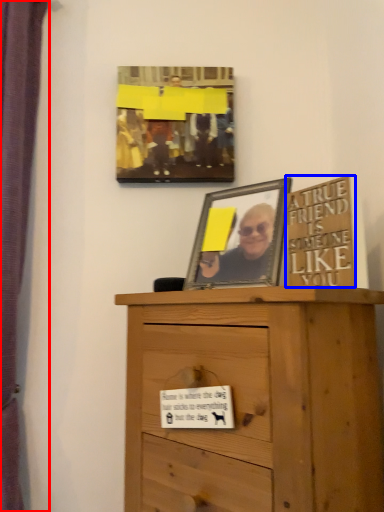
Question: Which point is closer to the camera, curtain (highlighted by a red box) or writing (highlighted by a blue box)?

Choices:
 (A) curtain
 (B) writing

Answer: (B)